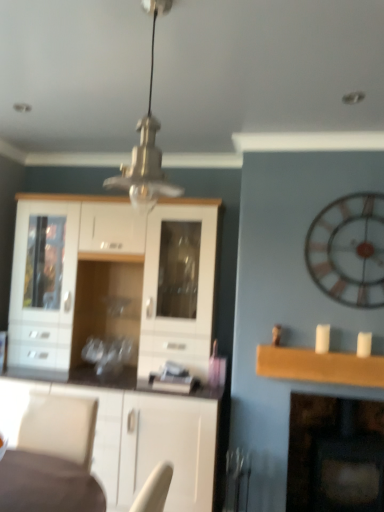
Question: Considering the relative positions of wooden clock at right and dark brown wood fireplace at lower right in the image provided, is wooden clock at right to the right of dark brown wood fireplace at lower right from the viewer's perspective?

Choices:
 (A) yes
 (B) no

Answer: (B)

Question: Is wooden clock at right taller than dark brown wood fireplace at lower right?

Choices:
 (A) no
 (B) yes

Answer: (A)

Question: Considering the relative sizes of wooden clock at right and dark brown wood fireplace at lower right in the image provided, is wooden clock at right wider than dark brown wood fireplace at lower right?

Choices:
 (A) yes
 (B) no

Answer: (B)

Question: From the image's perspective, is wooden clock at right beneath dark brown wood fireplace at lower right?

Choices:
 (A) yes
 (B) no

Answer: (B)

Question: Considering the relative positions of wooden clock at right and dark brown wood fireplace at lower right in the image provided, is wooden clock at right to the left of dark brown wood fireplace at lower right from the viewer's perspective?

Choices:
 (A) yes
 (B) no

Answer: (A)

Question: Looking at their shapes, would you say metallic glass pendant light at center is wider or thinner than wooden clock at right?

Choices:
 (A) wide
 (B) thin

Answer: (A)

Question: Is point (152, 25) positioned closer to the camera than point (352, 261)?

Choices:
 (A) closer
 (B) farther

Answer: (A)

Question: Is metallic glass pendant light at center to the left or to the right of wooden clock at right in the image?

Choices:
 (A) right
 (B) left

Answer: (B)

Question: From a real-world perspective, is metallic glass pendant light at center physically located above or below wooden clock at right?

Choices:
 (A) above
 (B) below

Answer: (A)

Question: Considering the relative positions of white glossy cabinet at center and wooden clock at right in the image provided, is white glossy cabinet at center to the left or to the right of wooden clock at right?

Choices:
 (A) left
 (B) right

Answer: (A)

Question: From the image's perspective, is white glossy cabinet at center positioned above or below wooden clock at right?

Choices:
 (A) above
 (B) below

Answer: (B)

Question: Relative to wooden clock at right, is white glossy cabinet at center in front or behind?

Choices:
 (A) front
 (B) behind

Answer: (B)

Question: Is white glossy cabinet at center inside the boundaries of wooden clock at right, or outside?

Choices:
 (A) outside
 (B) inside

Answer: (A)

Question: Considering the positions of dark brown wood fireplace at lower right and metallic glass pendant light at center in the image, is dark brown wood fireplace at lower right wider or thinner than metallic glass pendant light at center?

Choices:
 (A) wide
 (B) thin

Answer: (A)

Question: From a real-world perspective, relative to metallic glass pendant light at center, is dark brown wood fireplace at lower right vertically above or below?

Choices:
 (A) above
 (B) below

Answer: (B)